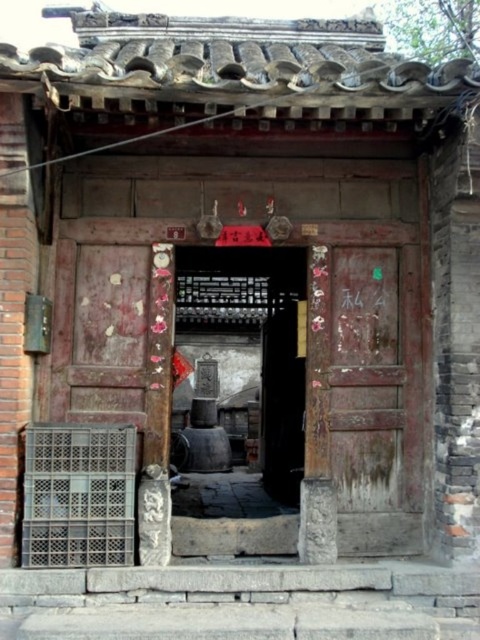
Who is taller, wooden door at center or white paper at center?

Standing taller between the two is wooden door at center.

Is wooden door at center below white paper at center?

Correct, wooden door at center is located below white paper at center.

Does point (231, 360) come behind point (351, 301)?

Yes.

The image size is (480, 640). I want to click on wooden door at center, so click(239, 400).

Who is more forward, (381,454) or (374,300)?

Point (381,454)

Is rusty wooden door at center positioned behind white paper at center?

No.

What do you see at coordinates (365, 388) in the screenshot? The width and height of the screenshot is (480, 640). I see `rusty wooden door at center` at bounding box center [365, 388].

You are a GUI agent. You are given a task and a screenshot of the screen. Output one action in this format:
    pyautogui.click(x=<x>, y=<y>)
    Task: Click on the rusty wooden door at center
    Image resolution: width=480 pixels, height=640 pixels.
    Given the screenshot: What is the action you would take?
    pyautogui.click(x=365, y=388)

Looking at this image, who is more forward, (190, 436) or (418, 417)?

Point (418, 417)

Is wooden door at center taller than rusty wooden door at center?

Incorrect, wooden door at center's height is not larger of rusty wooden door at center's.

Identify the location of wooden door at center. Image resolution: width=480 pixels, height=640 pixels. (239, 400).

At what (x,y) coordinates should I click in order to perform the action: click on wooden door at center. Please return your answer as a coordinate pair (x, y). Looking at the image, I should click on (239, 400).